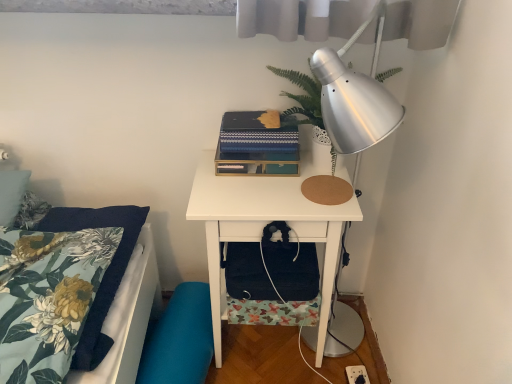
Locate an element on the screen. vacant space situated above teal fabric swivel chair at lower left (from a real-world perspective) is located at coordinates (172, 340).